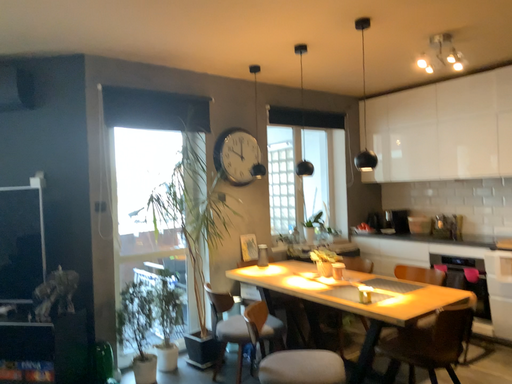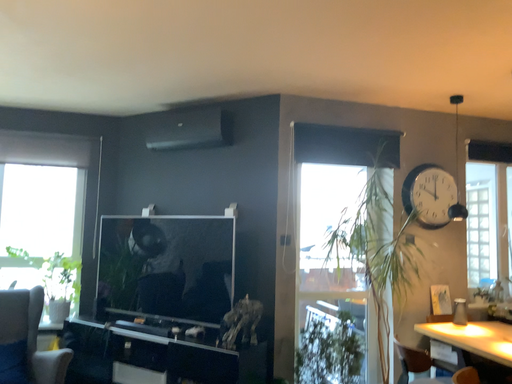
Question: Which way did the camera rotate in the video?

Choices:
 (A) rotated right
 (B) rotated left

Answer: (B)